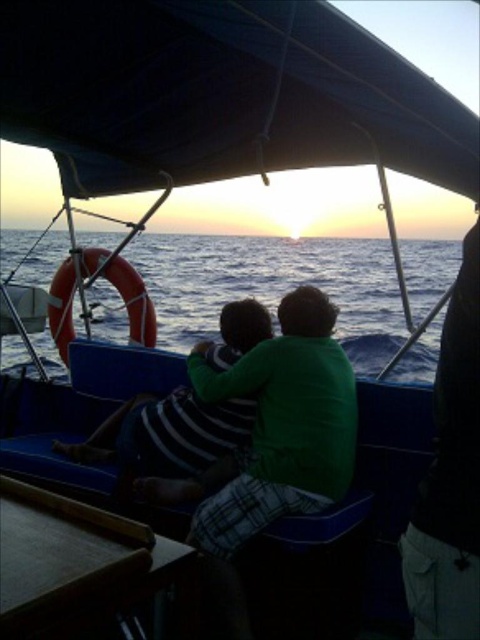
Does point (292, 278) come farther from viewer compared to point (465, 316)?

Yes, it is.

Can you confirm if blue water at center is positioned above green fabric shirt at right?

Yes.

Is point (285, 260) in front of point (476, 342)?

No, (285, 260) is behind (476, 342).

Find the location of a particular element. blue water at center is located at coordinates (273, 285).

Is green cotton shirt at center positioned at the back of green fabric shirt at right?

Yes, it is.

Is point (93, 452) positioned after point (429, 630)?

Yes, it is.

At what (x,y) coordinates should I click in order to perform the action: click on green cotton shirt at center. Please return your answer as a coordinate pair (x, y). The width and height of the screenshot is (480, 640). Looking at the image, I should click on [275, 429].

Between blue water at center and green cotton shirt at center, which one appears on the left side from the viewer's perspective?

green cotton shirt at center

Is blue water at center below green cotton shirt at center?

No, blue water at center is not below green cotton shirt at center.

Between point (343, 272) and point (288, 412), which one is positioned behind?

Positioned behind is point (343, 272).

You are a GUI agent. You are given a task and a screenshot of the screen. Output one action in this format:
    pyautogui.click(x=<x>, y=<y>)
    Task: Click on the blue water at center
    The width and height of the screenshot is (480, 640).
    Given the screenshot: What is the action you would take?
    pyautogui.click(x=273, y=285)